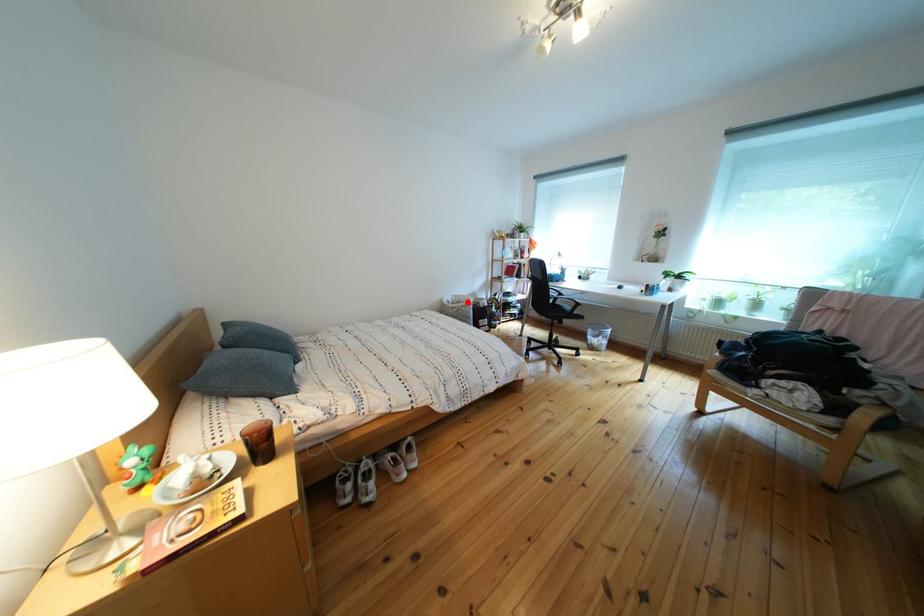
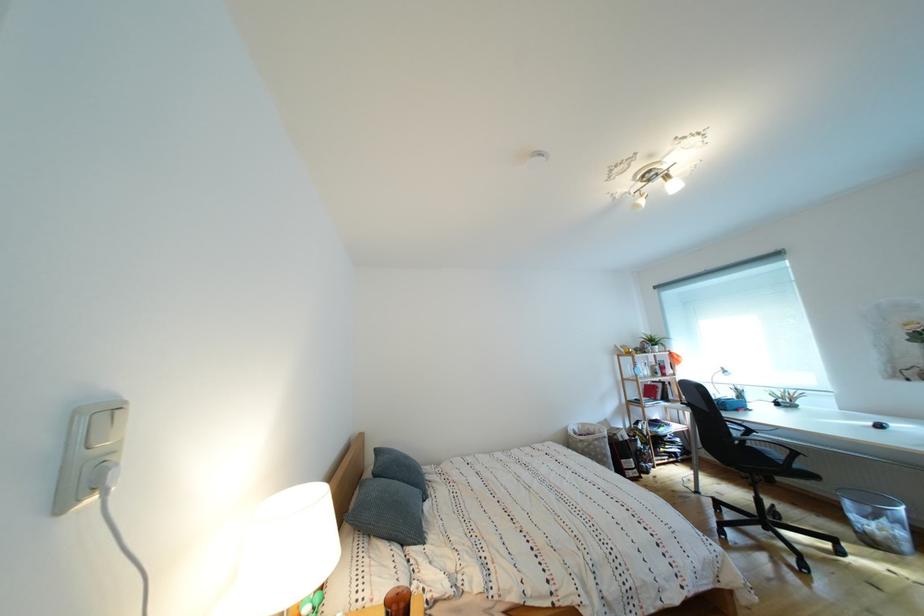
Question: I am providing you with two images of the same scene from different viewpoints. A red point is shown in image1. For the corresponding object point in image2, is it positioned nearer or farther from the camera?

Choices:
 (A) Nearer
 (B) Farther

Answer: (B)